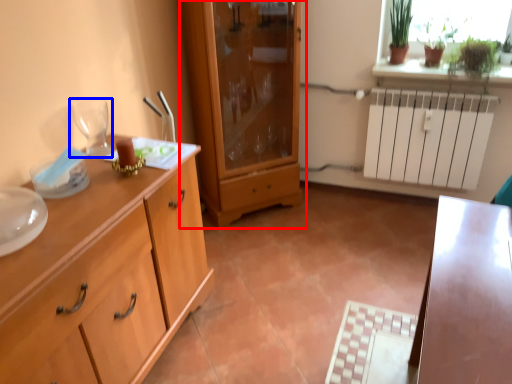
Question: Which object is further to the camera taking this photo, cupboard (highlighted by a red box) or wine glass (highlighted by a blue box)?

Choices:
 (A) cupboard
 (B) wine glass

Answer: (A)